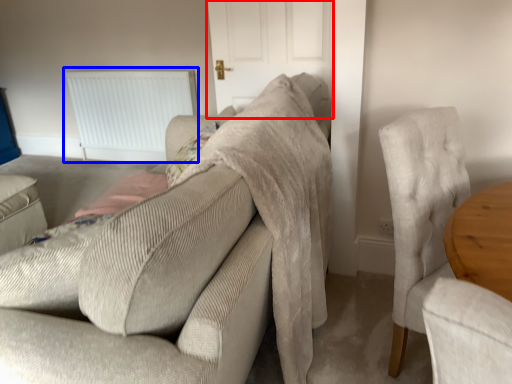
Question: Which point is further to the camera, door (highlighted by a red box) or radiator (highlighted by a blue box)?

Choices:
 (A) door
 (B) radiator

Answer: (B)